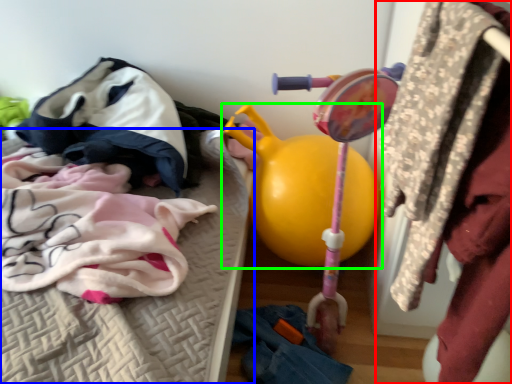
Question: Which object is the closest to the closet (highlighted by a red box)? Choose among these: furniture (highlighted by a blue box) or toy (highlighted by a green box).

Choices:
 (A) furniture
 (B) toy

Answer: (B)